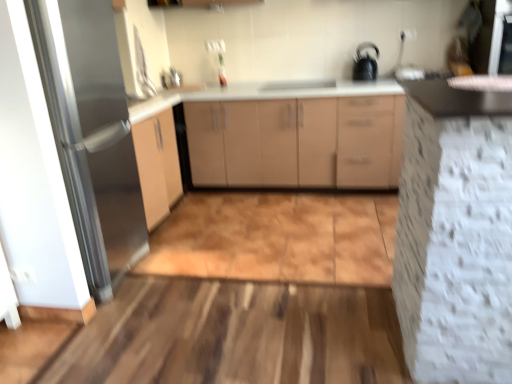
Identify the location of free spot in front of satin silver fridge at left. (74, 338).